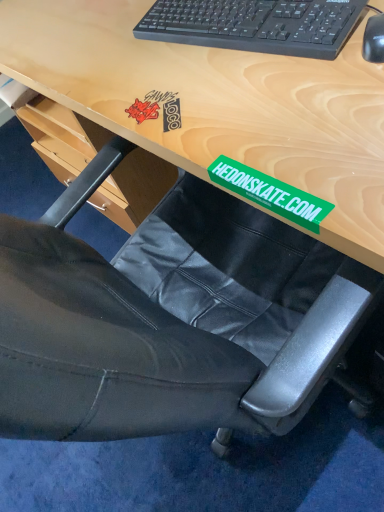
Question: Is black plastic mouse at upper right in front of or behind black plastic keyboard at upper center in the image?

Choices:
 (A) front
 (B) behind

Answer: (A)

Question: From a real-world perspective, is black plastic mouse at upper right positioned above or below black plastic keyboard at upper center?

Choices:
 (A) below
 (B) above

Answer: (A)

Question: Is black plastic mouse at upper right spatially inside black plastic keyboard at upper center, or outside of it?

Choices:
 (A) outside
 (B) inside

Answer: (A)

Question: Based on their sizes in the image, would you say black plastic keyboard at upper center is bigger or smaller than black plastic mouse at upper right?

Choices:
 (A) small
 (B) big

Answer: (B)

Question: Relative to black plastic mouse at upper right, is black plastic keyboard at upper center in front or behind?

Choices:
 (A) front
 (B) behind

Answer: (B)

Question: From the image's perspective, is black plastic keyboard at upper center positioned above or below black plastic mouse at upper right?

Choices:
 (A) above
 (B) below

Answer: (A)

Question: Considering the positions of black plastic keyboard at upper center and black plastic mouse at upper right in the image, is black plastic keyboard at upper center taller or shorter than black plastic mouse at upper right?

Choices:
 (A) tall
 (B) short

Answer: (A)